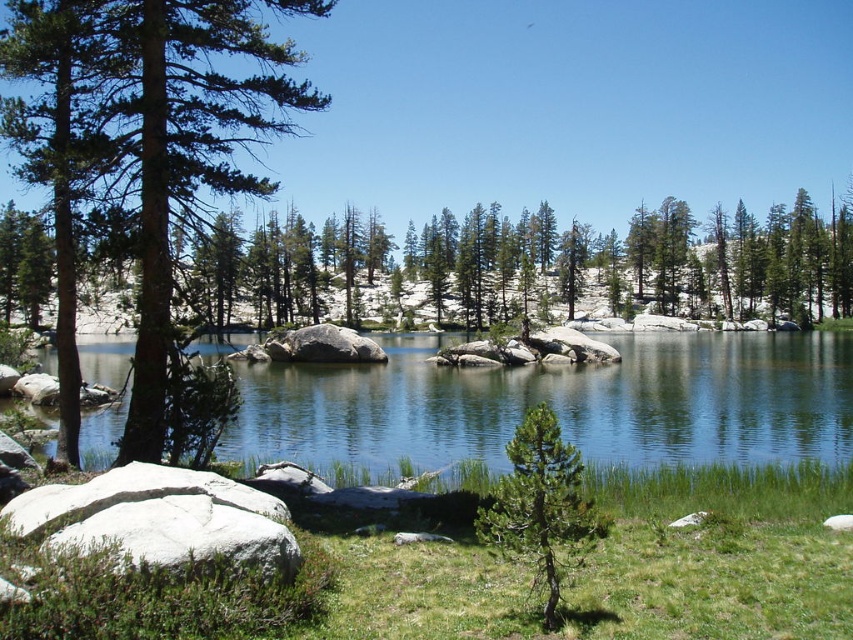
Question: Is clear blue water at center below green matte tree at left?

Choices:
 (A) yes
 (B) no

Answer: (A)

Question: Based on their relative distances, which object is nearer to the gray rough boulder at center?

Choices:
 (A) green matte tree at center
 (B) white rough boulder at lower left
 (C) green matte tree at left

Answer: (B)

Question: Can you confirm if clear blue water at center is positioned above gray rough boulder at center?

Choices:
 (A) yes
 (B) no

Answer: (B)

Question: Which point is farther from the camera taking this photo?

Choices:
 (A) (345, 348)
 (B) (344, 403)

Answer: (A)

Question: Which point is farther to the camera?

Choices:
 (A) (106, 372)
 (B) (312, 348)

Answer: (A)

Question: Can you confirm if green matte tree at left is positioned below gray rough boulder at center?

Choices:
 (A) no
 (B) yes

Answer: (A)